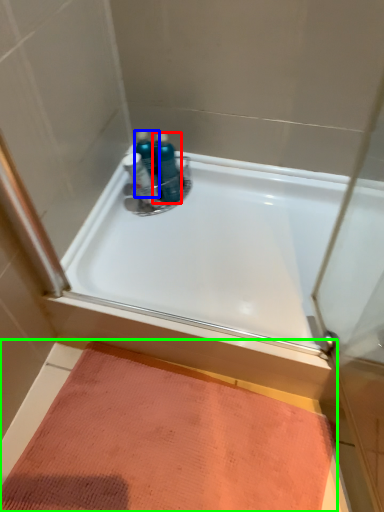
Question: Based on their relative distances, which object is farther from toiletry (highlighted by a red box)? Choose from toiletry (highlighted by a blue box) and doormat (highlighted by a green box).

Choices:
 (A) toiletry
 (B) doormat

Answer: (B)